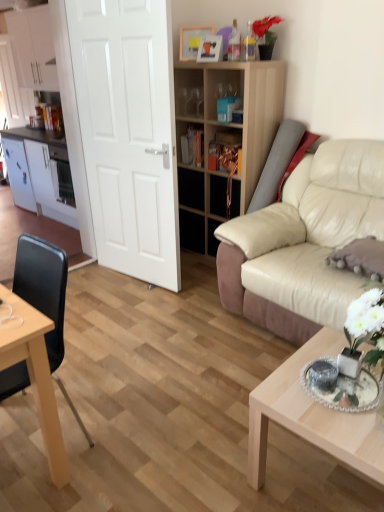
In order to face black leather chair at left, should I rotate leftwards or rightwards?

You should rotate left by 23.285 degrees.

This screenshot has height=512, width=384. Describe the element at coordinates (33, 48) in the screenshot. I see `white glossy cabinet at upper left, the 1th cabinetry viewed from the top` at that location.

The height and width of the screenshot is (512, 384). Find the location of `white matte door at center`. white matte door at center is located at coordinates (128, 133).

Is white glossy cabinet at left, which is the 2th cabinetry from bottom to top, facing towards gray suede pillow at right?

No.

Is white glossy cabinet at left, which appears as the 2th cabinetry when viewed from the top, inside or outside of gray suede pillow at right?

white glossy cabinet at left, which appears as the 2th cabinetry when viewed from the top, is outside gray suede pillow at right.

How different are the orientations of white glossy cabinet at left, which appears as the 2th cabinetry when viewed from the top, and gray suede pillow at right in degrees?

white glossy cabinet at left, which appears as the 2th cabinetry when viewed from the top, and gray suede pillow at right are facing 5.47 degrees away from each other.

Which of these two, white glossy cabinet at left, which is the 2th cabinetry from bottom to top, or gray suede pillow at right, stands shorter?

gray suede pillow at right is shorter.

Does gray suede pillow at right appear on the right side of beige leather couch at right?

Yes, gray suede pillow at right is to the right of beige leather couch at right.

How different are the orientations of gray suede pillow at right and beige leather couch at right in degrees?

The angular difference between gray suede pillow at right and beige leather couch at right is 0.000679 degrees.

Considering their positions, is gray suede pillow at right located in front of or behind beige leather couch at right?

In the image, gray suede pillow at right appears behind beige leather couch at right.

Is point (362, 242) farther from camera compared to point (310, 204)?

No.

Measure the distance from white glossy cabinet at upper left, the 1th cabinetry viewed from the top, to white matte door at center.

white glossy cabinet at upper left, the 1th cabinetry viewed from the top, is 9.57 feet from white matte door at center.

From the image's perspective, which is above, white glossy cabinet at upper left, the third cabinetry in the bottom-to-top sequence, or white matte door at center?

white glossy cabinet at upper left, the third cabinetry in the bottom-to-top sequence, appears higher in the image.

Considering the relative positions of white glossy cabinet at upper left, the 1th cabinetry viewed from the top, and white matte door at center in the image provided, is white glossy cabinet at upper left, the 1th cabinetry viewed from the top, in front of white matte door at center?

That is False.

Which is behind, point (34, 41) or point (172, 110)?

The point (34, 41) is farther from the camera.

Does wooden shelf at center have a smaller size compared to light wood/texture coffee table at lower right?

No.

At what (x,y) coordinates should I click in order to perform the action: click on coffee table below the wooden shelf at center (from a real-world perspective). Please return your answer as a coordinate pair (x, y). Looking at the image, I should click on (313, 417).

Does point (247, 121) come farther from viewer compared to point (296, 367)?

That is True.

Are wooden shelf at center and light wood/texture coffee table at lower right making contact?

No.

Considering the positions of objects white glossy cabinet at left, which is the 2th cabinetry from bottom to top, and matte white cabinet at left in the image provided, who is in front, white glossy cabinet at left, which is the 2th cabinetry from bottom to top, or matte white cabinet at left?

matte white cabinet at left is closer to the camera.

Is white glossy cabinet at left, which is the 2th cabinetry from bottom to top, far from matte white cabinet at left?

Actually, white glossy cabinet at left, which is the 2th cabinetry from bottom to top, and matte white cabinet at left are a little close together.

Consider the image. Which of these two, white glossy cabinet at left, which appears as the 2th cabinetry when viewed from the top, or matte white cabinet at left, is bigger?

matte white cabinet at left is bigger.

From the image's perspective, which one is positioned lower, white glossy cabinet at left, which appears as the 2th cabinetry when viewed from the top, or matte white cabinet at left?

matte white cabinet at left is shown below in the image.

Is white matte door at center not within white glossy cabinet at upper left, the 1th cabinetry viewed from the top?

That's correct, white matte door at center is outside of white glossy cabinet at upper left, the 1th cabinetry viewed from the top.

From a real-world perspective, is white matte door at center positioned above or below white glossy cabinet at upper left, the third cabinetry in the bottom-to-top sequence?

Clearly, from a real-world perspective, white matte door at center is below white glossy cabinet at upper left, the third cabinetry in the bottom-to-top sequence.

Are white matte door at center and white glossy cabinet at upper left, the third cabinetry in the bottom-to-top sequence, far apart?

That's right, there is a large distance between white matte door at center and white glossy cabinet at upper left, the third cabinetry in the bottom-to-top sequence.

Who is smaller, white matte door at center or white glossy cabinet at upper left, the third cabinetry in the bottom-to-top sequence?

With smaller size is white matte door at center.

How many degrees apart are the facing directions of matte white cabinet at left and white glossy cabinets at left, which appears as the 3th cabinetry when viewed from the top?

matte white cabinet at left and white glossy cabinets at left, which appears as the 3th cabinetry when viewed from the top, are facing 89.7 degrees away from each other.

Considering the positions of objects matte white cabinet at left and white glossy cabinets at left, which appears as the 3th cabinetry when viewed from the top, in the image provided, who is more to the left, matte white cabinet at left or white glossy cabinets at left, which appears as the 3th cabinetry when viewed from the top,?

white glossy cabinets at left, which appears as the 3th cabinetry when viewed from the top, is more to the left.

Locate an element on the screen. This screenshot has width=384, height=512. cabinetry located underneath the matte white cabinet at left (from a real-world perspective) is located at coordinates (39, 172).

From a real-world perspective, is matte white cabinet at left on white glossy cabinets at left, the 1th cabinetry from the bottom?

Yes.

The width and height of the screenshot is (384, 512). I want to click on pillow lying in front of the white glossy cabinet at left, which is the 2th cabinetry from bottom to top, so click(361, 257).

Identify the location of pillow on the right of beige leather couch at right. This screenshot has width=384, height=512. (361, 257).

From the image, which object appears to be nearer to white glossy cabinet at left, which is the 2th cabinetry from bottom to top, black leather chair at left or light wood/texture coffee table at lower right?

black leather chair at left is positioned closer to the anchor white glossy cabinet at left, which is the 2th cabinetry from bottom to top.

In the scene shown: Which object lies nearer to the anchor point white glossy cabinet at left, which is the 2th cabinetry from bottom to top, white glossy cabinets at left, which appears as the 3th cabinetry when viewed from the top, or light wood/texture coffee table at lower right?

The object closer to white glossy cabinet at left, which is the 2th cabinetry from bottom to top, is white glossy cabinets at left, which appears as the 3th cabinetry when viewed from the top.

Estimate the real-world distances between objects in this image. Which object is further from white matte door at center, white glossy cabinets at left, the 1th cabinetry from the bottom, or white glossy cabinet at upper left, the third cabinetry in the bottom-to-top sequence?

Based on the image, white glossy cabinet at upper left, the third cabinetry in the bottom-to-top sequence, appears to be further to white matte door at center.

When comparing their distances from wooden shelf at center, does light wood/texture coffee table at lower right or white glossy cabinet at upper left, the 1th cabinetry viewed from the top, seem closer?

light wood/texture coffee table at lower right is closer to wooden shelf at center.

Considering their positions, is white matte door at center positioned further to white glossy cabinet at upper left, the 1th cabinetry viewed from the top, than gray suede pillow at right?

Among the two, gray suede pillow at right is located further to white glossy cabinet at upper left, the 1th cabinetry viewed from the top.

From the image, which object appears to be nearer to white glossy cabinet at left, which is the 2th cabinetry from bottom to top, white glossy cabinet at upper left, the 1th cabinetry viewed from the top, or white glossy cabinets at left, the 1th cabinetry from the bottom?

Based on the image, white glossy cabinet at upper left, the 1th cabinetry viewed from the top, appears to be nearer to white glossy cabinet at left, which is the 2th cabinetry from bottom to top.

Based on their spatial positions, is white glossy cabinet at upper left, the third cabinetry in the bottom-to-top sequence, or light wood/texture coffee table at lower right further from matte white cabinet at left?

Among the two, light wood/texture coffee table at lower right is located further to matte white cabinet at left.

Estimate the real-world distances between objects in this image. Which object is further from white glossy cabinet at left, which is the 2th cabinetry from bottom to top, white glossy cabinet at upper left, the third cabinetry in the bottom-to-top sequence, or light wood/texture coffee table at lower right?

light wood/texture coffee table at lower right is positioned further to the anchor white glossy cabinet at left, which is the 2th cabinetry from bottom to top.

Identify the location of shelf positioned between light wood/texture coffee table at lower right and white glossy cabinets at left, which appears as the 3th cabinetry when viewed from the top, from near to far. The height and width of the screenshot is (512, 384). (215, 136).

At what (x,y) coordinates should I click in order to perform the action: click on shelf between white glossy cabinet at upper left, the 1th cabinetry viewed from the top, and gray suede pillow at right, in the horizontal direction. Please return your answer as a coordinate pair (x, y). The image size is (384, 512). Looking at the image, I should click on (215, 136).

Image resolution: width=384 pixels, height=512 pixels. Find the location of `shelf between white glossy cabinet at left, which appears as the 2th cabinetry when viewed from the top, and gray suede pillow at right, in the horizontal direction`. shelf between white glossy cabinet at left, which appears as the 2th cabinetry when viewed from the top, and gray suede pillow at right, in the horizontal direction is located at coordinates (215, 136).

Where is `door between matte white cabinet at left and white glossy cabinet at upper left, the 1th cabinetry viewed from the top, in the front-back direction`? door between matte white cabinet at left and white glossy cabinet at upper left, the 1th cabinetry viewed from the top, in the front-back direction is located at coordinates (128, 133).